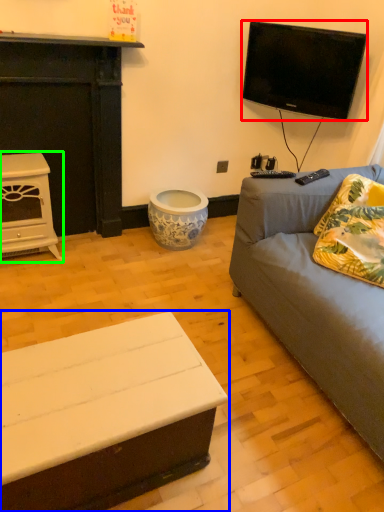
Question: Estimate the real-world distances between objects in this image. Which object is farther from television (highlighted by a red box), coffee table (highlighted by a blue box) or fireplace (highlighted by a green box)?

Choices:
 (A) coffee table
 (B) fireplace

Answer: (A)